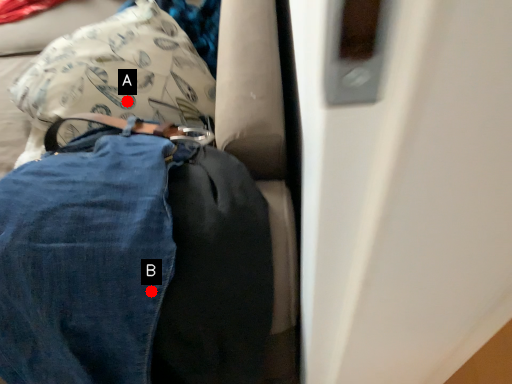
Question: Two points are circled on the image, labeled by A and B beside each circle. Which of the following is the farthest from the observer?

Choices:
 (A) A is further
 (B) B is further

Answer: (A)